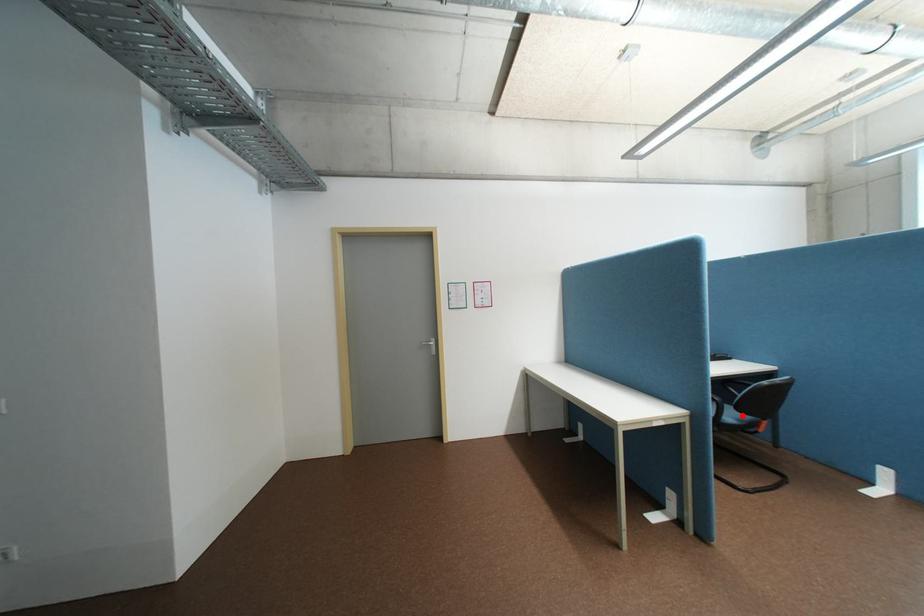
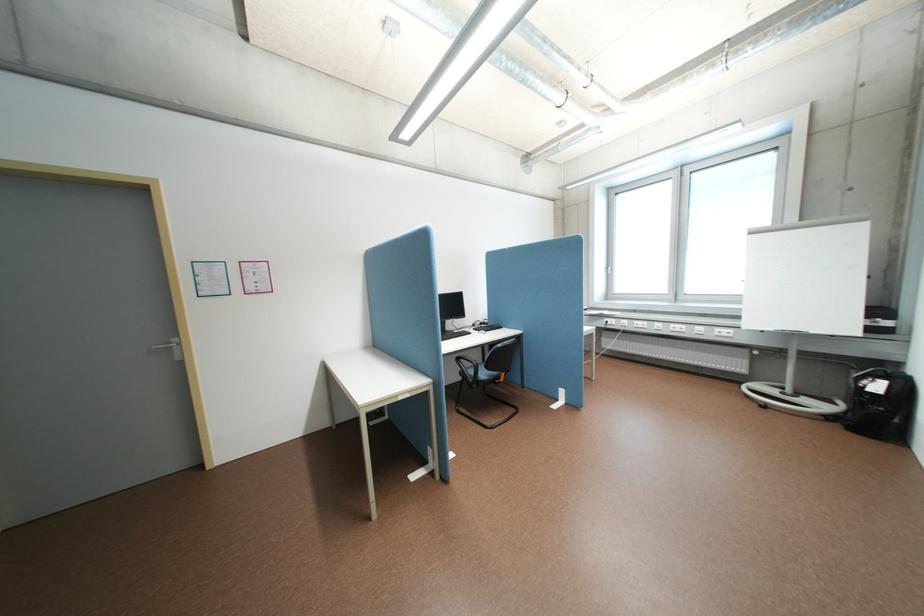
Question: A red point is marked in image1. In image2, is the corresponding 3D point closer to the camera or farther? Reply with the corresponding letter.

Choices:
 (A) The corresponding 3D point is closer.
 (B) The corresponding 3D point is farther.

Answer: (A)